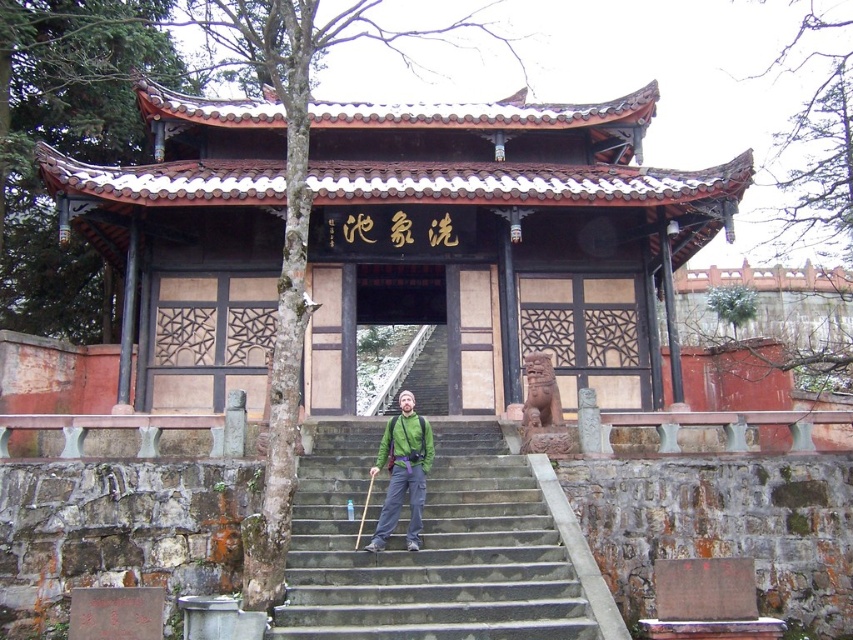
Question: Does gray stone stairs at center come behind green fabric backpack at center?

Choices:
 (A) yes
 (B) no

Answer: (B)

Question: Which of the following is the closest to the observer?

Choices:
 (A) (386, 518)
 (B) (323, 528)

Answer: (A)

Question: Is gray stone stairs at center positioned behind green fabric backpack at center?

Choices:
 (A) no
 (B) yes

Answer: (A)

Question: Can you confirm if gray stone stairs at center is thinner than green fabric backpack at center?

Choices:
 (A) no
 (B) yes

Answer: (A)

Question: Which point is farther to the camera?

Choices:
 (A) green fabric backpack at center
 (B) gray stone stairs at center

Answer: (A)